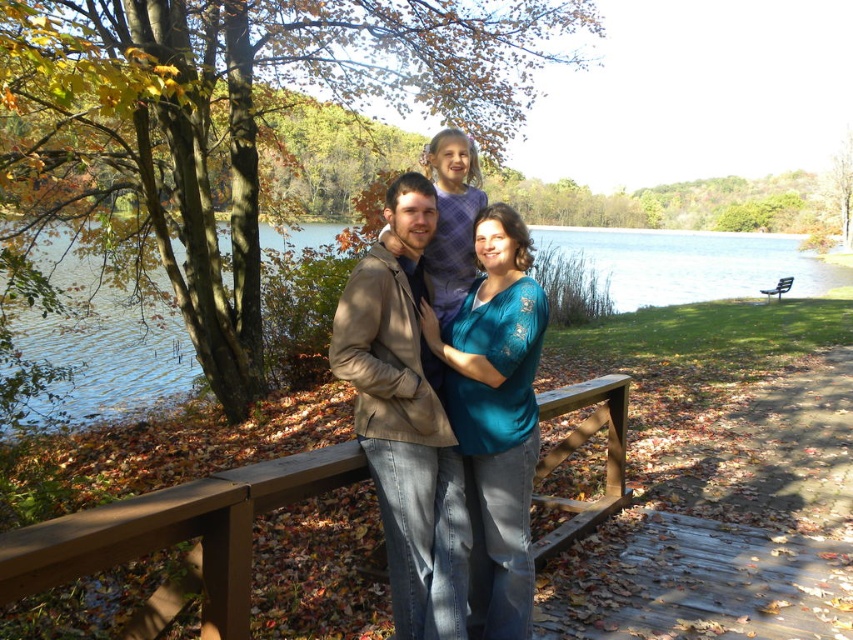
Between brown wooden rail at center and teal lace top at center, which one appears on the right side from the viewer's perspective?

brown wooden rail at center

Consider the image. Can you confirm if brown wooden rail at center is positioned to the left of teal lace top at center?

No, brown wooden rail at center is not to the left of teal lace top at center.

Is point (351, 468) farther from camera compared to point (486, 244)?

No.

Image resolution: width=853 pixels, height=640 pixels. What are the coordinates of `brown wooden rail at center` in the screenshot? It's located at (177, 538).

Does point (463, 397) come closer to viewer compared to point (770, 296)?

Yes, point (463, 397) is closer to viewer.

Between point (520, 365) and point (782, 292), which one is positioned in front?

Point (520, 365) is in front.

At what (x,y) coordinates should I click in order to perform the action: click on teal lace top at center. Please return your answer as a coordinate pair (x, y). The height and width of the screenshot is (640, 853). Looking at the image, I should click on (496, 417).

Does clear blue water at upper center appear on the left side of teal lace top at center?

Incorrect, clear blue water at upper center is not on the left side of teal lace top at center.

Does clear blue water at upper center appear over teal lace top at center?

Yes.

You are a GUI agent. You are given a task and a screenshot of the screen. Output one action in this format:
    pyautogui.click(x=<x>, y=<y>)
    Task: Click on the clear blue water at upper center
    This screenshot has width=853, height=640.
    Given the screenshot: What is the action you would take?
    tap(692, 262)